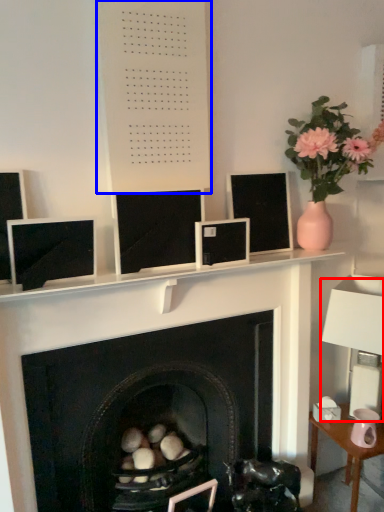
Question: Which point is closer to the camera, table lamp (highlighted by a red box) or bulletin board (highlighted by a blue box)?

Choices:
 (A) table lamp
 (B) bulletin board

Answer: (B)